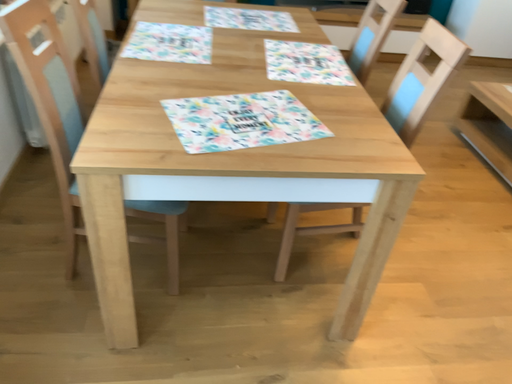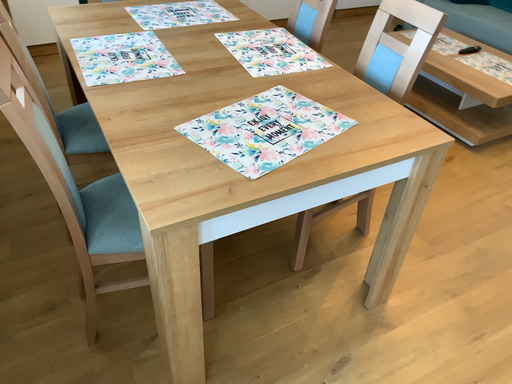
Question: How did the camera likely rotate when shooting the video?

Choices:
 (A) rotated right
 (B) rotated left

Answer: (A)